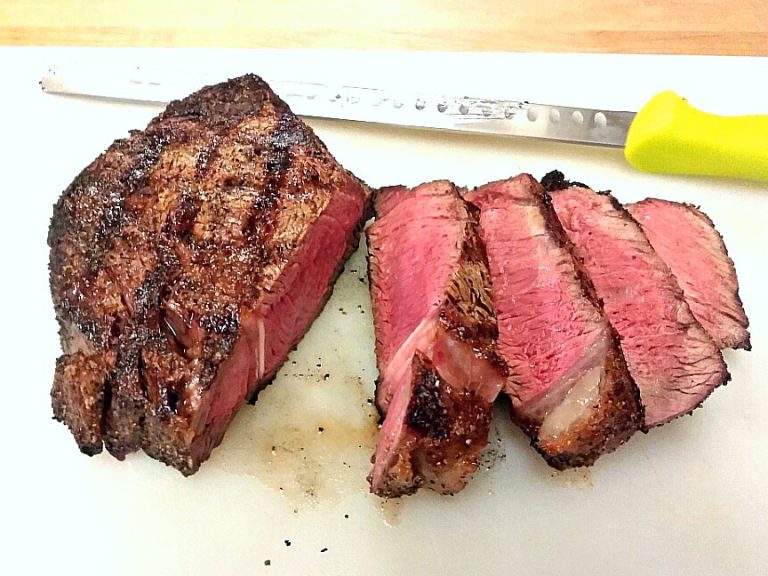
This screenshot has height=576, width=768. I want to click on table, so click(260, 481).